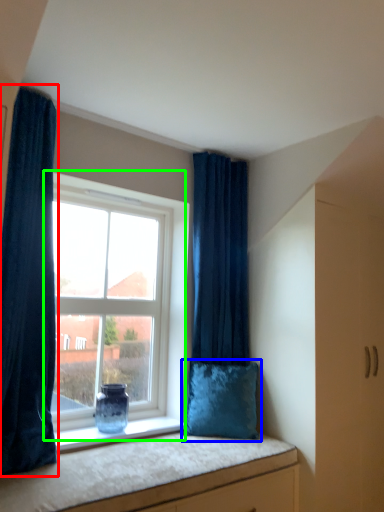
Question: Estimate the real-world distances between objects in this image. Which object is farther from curtain (highlighted by a red box), pillow (highlighted by a blue box) or window (highlighted by a green box)?

Choices:
 (A) pillow
 (B) window

Answer: (A)